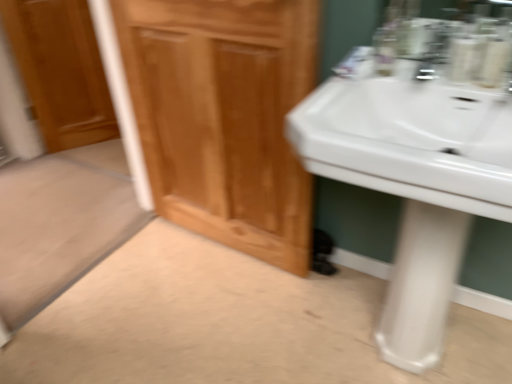
Question: Could you tell me if white glossy pedestal at lower right is turned towards wooden cabinet at center?

Choices:
 (A) yes
 (B) no

Answer: (B)

Question: Does white glossy pedestal at lower right have a greater height compared to wooden cabinet at center?

Choices:
 (A) yes
 (B) no

Answer: (B)

Question: Is white glossy pedestal at lower right bigger than wooden cabinet at center?

Choices:
 (A) no
 (B) yes

Answer: (A)

Question: From the image's perspective, is white glossy pedestal at lower right on top of wooden cabinet at center?

Choices:
 (A) no
 (B) yes

Answer: (A)

Question: Is white glossy pedestal at lower right beside wooden cabinet at center?

Choices:
 (A) yes
 (B) no

Answer: (B)

Question: Is wooden cabinet at center completely or partially inside white glossy pedestal at lower right?

Choices:
 (A) yes
 (B) no

Answer: (B)

Question: From a real-world perspective, is wooden door at left on top of white glossy pedestal at lower right?

Choices:
 (A) yes
 (B) no

Answer: (A)

Question: Can you confirm if wooden door at left is smaller than white glossy pedestal at lower right?

Choices:
 (A) yes
 (B) no

Answer: (A)

Question: Is wooden door at left with white glossy pedestal at lower right?

Choices:
 (A) no
 (B) yes

Answer: (A)

Question: Considering the relative sizes of wooden door at left and white glossy pedestal at lower right in the image provided, is wooden door at left taller than white glossy pedestal at lower right?

Choices:
 (A) yes
 (B) no

Answer: (A)

Question: Could white glossy pedestal at lower right be considered to be inside wooden door at left?

Choices:
 (A) no
 (B) yes

Answer: (A)

Question: Considering the relative positions of wooden door at left and white glossy pedestal at lower right in the image provided, is wooden door at left to the right of white glossy pedestal at lower right from the viewer's perspective?

Choices:
 (A) no
 (B) yes

Answer: (A)

Question: Can you confirm if wooden cabinet at center is shorter than white glossy sink at right?

Choices:
 (A) no
 (B) yes

Answer: (A)